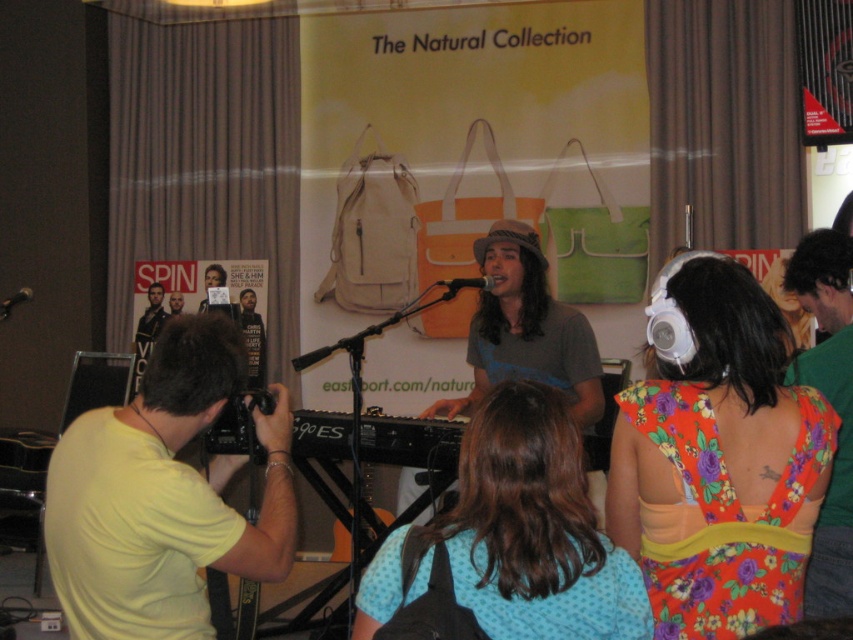
You are attending an event and want to take a photo of the yellow matte shirt at left without the matte black poster at center blocking the view. Is this possible?

The yellow matte shirt at left is positioned under the matte black poster at center, so you can take a photo of the yellow matte shirt at left without the matte black poster at center blocking the view by angling the camera downward.